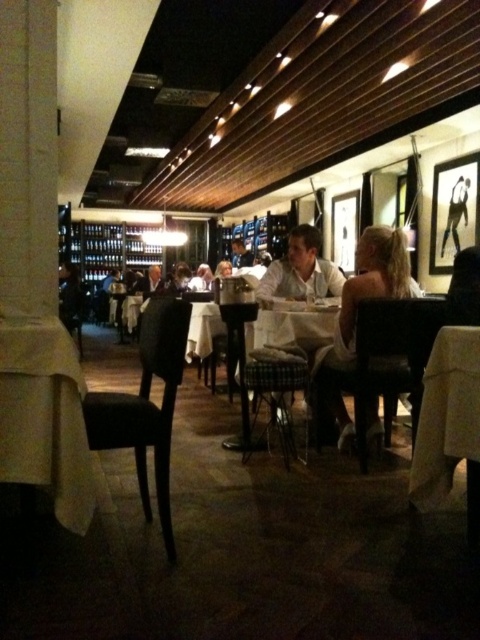
Question: Where is white cloth table at lower right located in relation to light brown leather chair at center in the image?

Choices:
 (A) above
 (B) below

Answer: (B)

Question: Based on their relative distances, which object is farther from the black leather chair at left?

Choices:
 (A) white linen table at lower left
 (B) matte black suit at center
 (C) silhouette paper at upper right

Answer: (B)

Question: Can you confirm if plaid fabric chair at center is positioned to the left of silhouette paper at upper right?

Choices:
 (A) no
 (B) yes

Answer: (B)

Question: Which is farther from the light brown leather chair at center?

Choices:
 (A) silhouette paper at upper right
 (B) white shirt at center
 (C) matte black suit at center

Answer: (C)

Question: Which object is farther from the camera taking this photo?

Choices:
 (A) light brown leather chair at center
 (B) smooth leather jacket at center
 (C) plaid fabric chair at center

Answer: (B)

Question: Can you confirm if white shirt at center is smaller than dark wood chair at center?

Choices:
 (A) yes
 (B) no

Answer: (A)